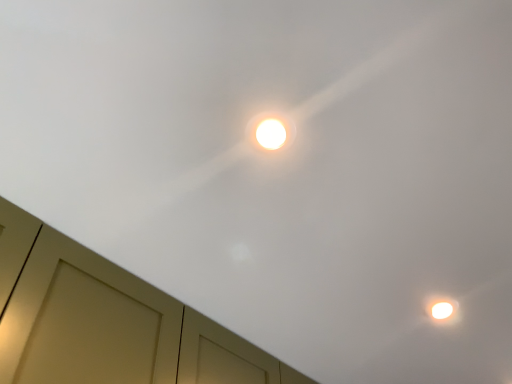
Question: Looking at their shapes, would you say white glossy droplight at center is wider or thinner than matte wood dresser at lower left?

Choices:
 (A) wide
 (B) thin

Answer: (B)

Question: From the image's perspective, is white glossy droplight at center located above or below matte wood dresser at lower left?

Choices:
 (A) above
 (B) below

Answer: (A)

Question: From a real-world perspective, is white glossy droplight at center physically located above or below matte wood dresser at lower left?

Choices:
 (A) above
 (B) below

Answer: (A)

Question: Does point click(273, 372) appear closer or farther from the camera than point click(289, 117)?

Choices:
 (A) farther
 (B) closer

Answer: (A)

Question: Is matte wood dresser at lower left to the left or to the right of white glossy droplight at center in the image?

Choices:
 (A) left
 (B) right

Answer: (A)

Question: From the image's perspective, is matte wood dresser at lower left located above or below white glossy droplight at center?

Choices:
 (A) above
 (B) below

Answer: (B)

Question: In the image, is matte wood dresser at lower left positioned in front of or behind white glossy droplight at center?

Choices:
 (A) behind
 (B) front

Answer: (B)